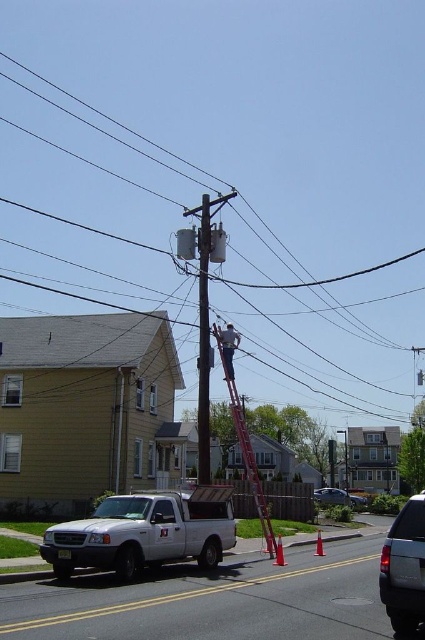
From the picture: You are a delivery driver who needs to drive your 2.5 meters tall truck through the narrow alley between the brown wooden telegraph pole at center and the silver metallic sedan at center. Can your truck pass through without hitting anything?

The brown wooden telegraph pole at center is taller than the silver metallic sedan at center. Since the truck is 2.5 meters tall, and the sedan is shorter, the truck can pass through the alley as long as there is enough horizontal space between them.

You are a pedestrian standing on the sidewalk and want to take a photo of both the brown wooden telegraph pole at center and the silver metallic sedan at center. Which object should you focus on first if you want to capture both in the same frame without moving your camera?

You should focus on the brown wooden telegraph pole at center first because it is closer to you than the silver metallic sedan at center, so adjusting the focus from near to far will help capture both in the same frame.

You are a delivery driver who needs to park your truck in this residential area. The parking spot you want is at coordinate point 0.833, 0.341. Is the white matte truck at lower left currently blocking that spot?

The white matte truck at lower left is already parked at coordinate point (x=144, y=532), so it is blocking the parking spot you want.